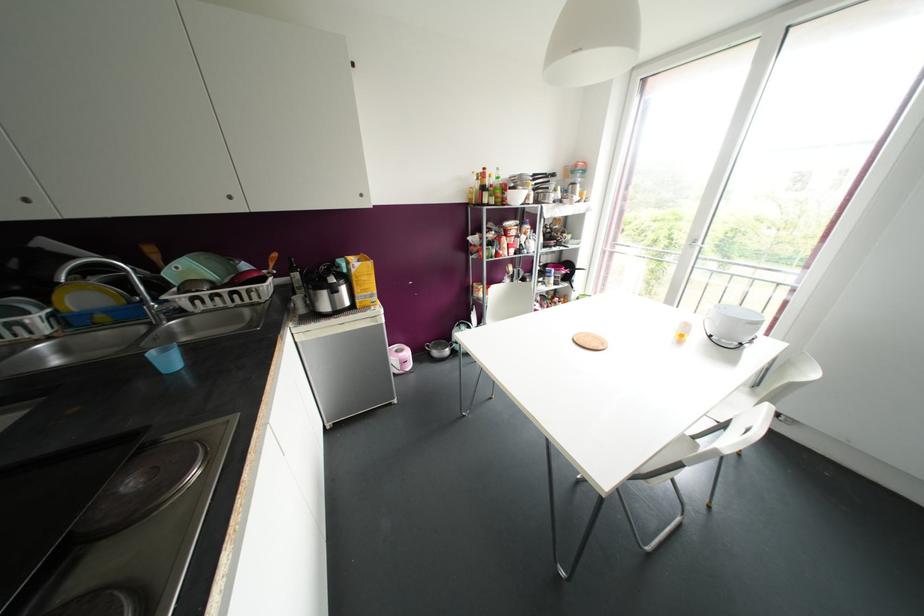
The location [682,331] corresponds to which object?

It corresponds to the small yellow bottle in the image.